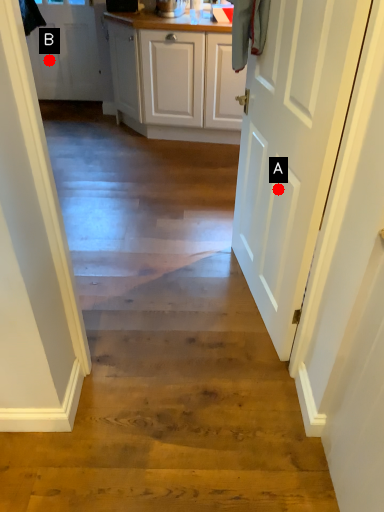
Question: Two points are circled on the image, labeled by A and B beside each circle. Which point is closer to the camera?

Choices:
 (A) A is closer
 (B) B is closer

Answer: (A)